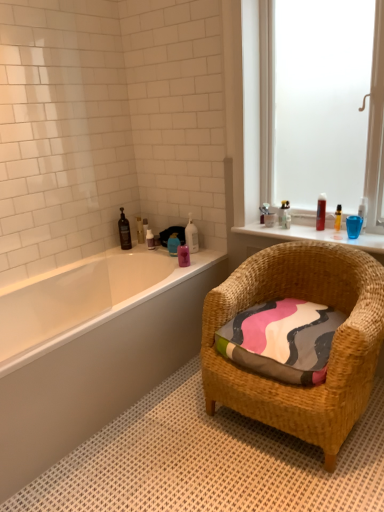
Locate an element on the screen. free spot in front of translucent plastic soap dispenser at upper left, the second toiletry when ordered from left to right is located at coordinates (141, 245).